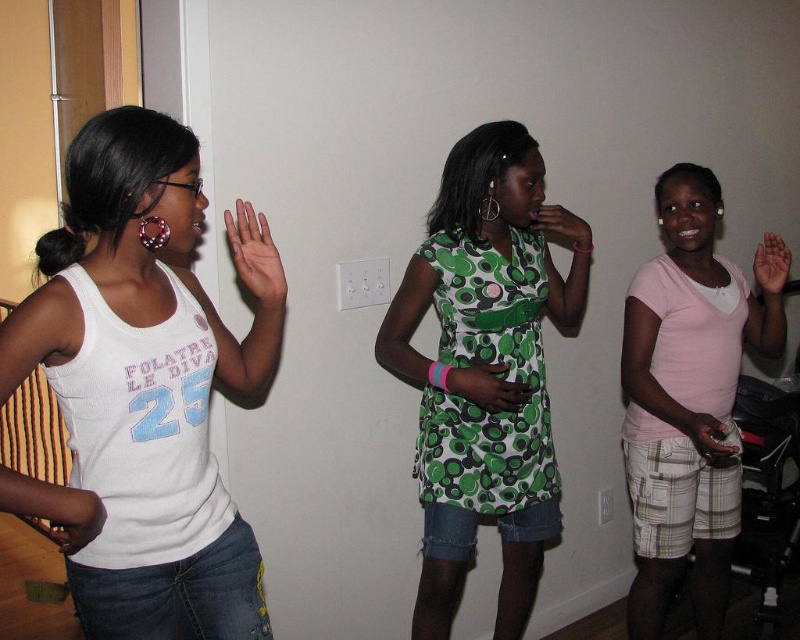
You are a photographer trying to capture a closeup of both hands in the center of the image. Since the white matte hand at center and the green fabric hand at center are overlapping, which hand should you focus on to ensure the larger one is in clear focus?

The white matte hand at center is larger in size than the green fabric hand at center, so you should focus on the white matte hand at center to ensure the larger one is in clear focus.

Based on the photo, you are standing at the camera position and want to reach the point at coordinates (472, 378). Is the distance more than 6 feet?

Yes, the distance between the camera and the point at coordinates (472, 378) is 6.43 feet, which is more than 6 feet.